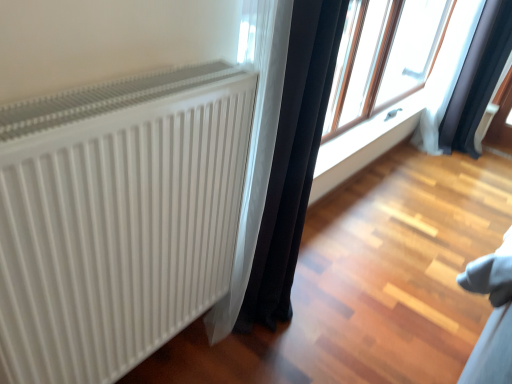
Question: Is white ribbed radiator at left behind black fabric curtain at upper right, the 2th curtain in the left-to-right sequence?

Choices:
 (A) no
 (B) yes

Answer: (A)

Question: Is white ribbed radiator at left aimed at black fabric curtain at upper right, which ranks as the 1th curtain in back-to-front order?

Choices:
 (A) no
 (B) yes

Answer: (A)

Question: Can you confirm if white ribbed radiator at left is bigger than black fabric curtain at upper right, the 2th curtain in the left-to-right sequence?

Choices:
 (A) yes
 (B) no

Answer: (B)

Question: Considering the relative sizes of white ribbed radiator at left and black fabric curtain at upper right, the 1th curtain positioned from the right, in the image provided, is white ribbed radiator at left thinner than black fabric curtain at upper right, the 1th curtain positioned from the right,?

Choices:
 (A) yes
 (B) no

Answer: (A)

Question: Is white ribbed radiator at left directly adjacent to black fabric curtain at upper right, the 1th curtain positioned from the right?

Choices:
 (A) yes
 (B) no

Answer: (B)

Question: Considering the positions of black fabric curtain at center, acting as the first curtain starting from the front, and transparent glass window at upper right in the image, is black fabric curtain at center, acting as the first curtain starting from the front, bigger or smaller than transparent glass window at upper right?

Choices:
 (A) big
 (B) small

Answer: (B)

Question: Is black fabric curtain at center, acting as the first curtain starting from the left, taller or shorter than transparent glass window at upper right?

Choices:
 (A) short
 (B) tall

Answer: (B)

Question: Do you think black fabric curtain at center, acting as the first curtain starting from the left, is within transparent glass window at upper right, or outside of it?

Choices:
 (A) inside
 (B) outside

Answer: (B)

Question: From a real-world perspective, is black fabric curtain at center, acting as the first curtain starting from the left, above or below transparent glass window at upper right?

Choices:
 (A) below
 (B) above

Answer: (A)

Question: Does point (357, 36) appear closer or farther from the camera than point (397, 127)?

Choices:
 (A) closer
 (B) farther

Answer: (A)

Question: Is transparent glass window at upper right taller or shorter than white smooth window sill at center?

Choices:
 (A) short
 (B) tall

Answer: (B)

Question: From the image's perspective, relative to white smooth window sill at center, is transparent glass window at upper right above or below?

Choices:
 (A) above
 (B) below

Answer: (A)

Question: In the image, is transparent glass window at upper right on the left side or the right side of white smooth window sill at center?

Choices:
 (A) right
 (B) left

Answer: (A)

Question: From a real-world perspective, is black fabric curtain at upper right, the 2th curtain in the left-to-right sequence, above or below black fabric curtain at center, acting as the first curtain starting from the left?

Choices:
 (A) below
 (B) above

Answer: (A)

Question: In the image, is black fabric curtain at upper right, positioned as the second curtain in front-to-back order, on the left side or the right side of black fabric curtain at center, acting as the first curtain starting from the left?

Choices:
 (A) right
 (B) left

Answer: (A)